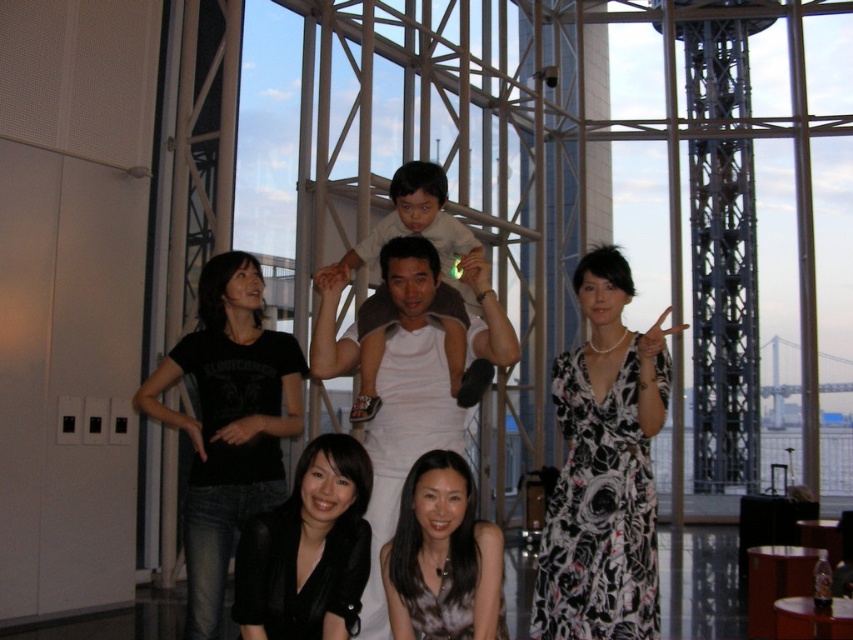
You are standing in front of the group photo and need to locate the black floral dress at center. According to the coordinates provided, where exactly should you look?

You should look at point (604,468) to find the black floral dress at center.

You are a photographer trying to capture a closeup of the black floral dress at center and the black satin blouse at lower center. Which one is positioned to the right side of the other?

The black floral dress at center is to the right of black satin blouse at lower center.